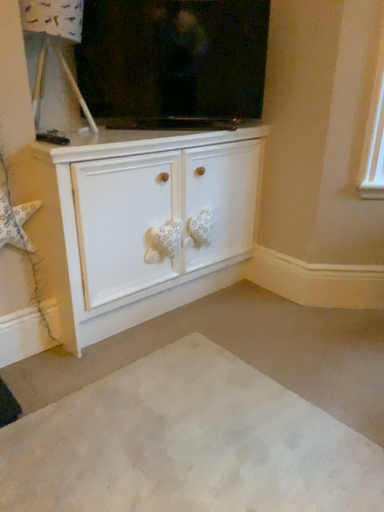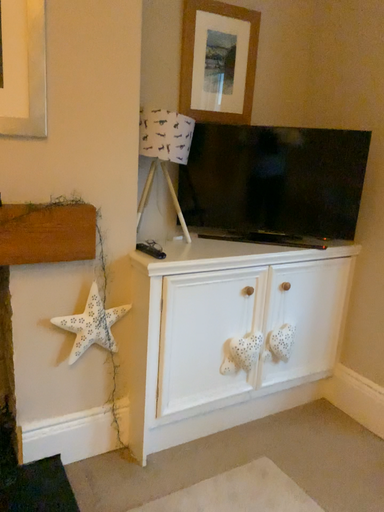
Question: How did the camera likely rotate when shooting the video?

Choices:
 (A) rotated upward
 (B) rotated downward

Answer: (A)